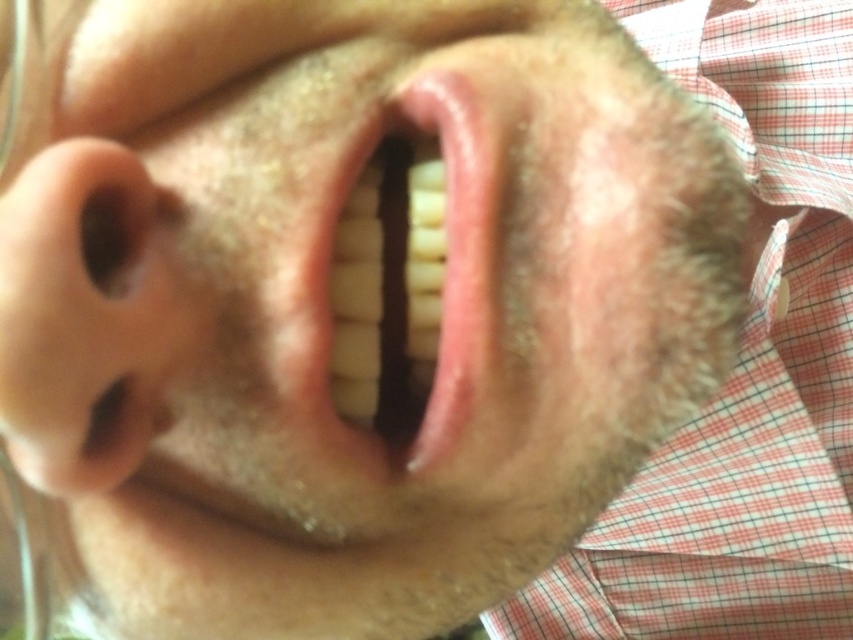
You are a makeup artist preparing to apply lipstick. You notice the red checkered fabric at right and the glossy pink lips at center in your view. Which object is larger in size?

The red checkered fabric at right is bigger than glossy pink lips at center, so the red checkered fabric at right is larger in size.

You are a photographer adjusting the focus on a camera. The subject is a person with a red and white checkered shirt. You need to focus on the point at point (85,316). Based on the scene description, what part of the person is this point likely located on?

The point (85,316) is on the pink flesh colored nose at left.

Looking at this image, you are a dentist examining a patient. You notice two points on their mouth area labeled as point (x=790, y=515) and point (x=44, y=260). Which point is closer to your viewpoint when looking at the patient?

Point (x=790, y=515) is further to the viewer than point (x=44, y=260), so the point closer to your viewpoint is point (x=44, y=260).